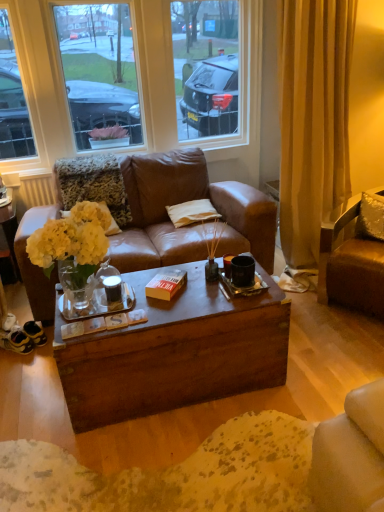
Question: From a real-world perspective, is brown leather chair at right on top of satin silver pillow at upper right, which ranks as the first pillow in right-to-left order?

Choices:
 (A) yes
 (B) no

Answer: (B)

Question: Does brown leather chair at right have a greater width compared to satin silver pillow at upper right, the first pillow in the front-to-back sequence?

Choices:
 (A) no
 (B) yes

Answer: (B)

Question: Does brown leather chair at right have a lesser height compared to satin silver pillow at upper right, the 2th pillow when ordered from left to right?

Choices:
 (A) yes
 (B) no

Answer: (B)

Question: Does brown leather chair at right have a greater height compared to satin silver pillow at upper right, which ranks as the first pillow in right-to-left order?

Choices:
 (A) no
 (B) yes

Answer: (B)

Question: Does brown leather chair at right have a smaller size compared to satin silver pillow at upper right, which ranks as the first pillow in right-to-left order?

Choices:
 (A) no
 (B) yes

Answer: (A)

Question: Looking at their shapes, would you say brown leather chair at right is wider or thinner than orange matte book at center?

Choices:
 (A) wide
 (B) thin

Answer: (A)

Question: Is brown leather chair at right taller or shorter than orange matte book at center?

Choices:
 (A) tall
 (B) short

Answer: (A)

Question: Considering the positions of point (352, 298) and point (183, 283), is point (352, 298) closer or farther from the camera than point (183, 283)?

Choices:
 (A) closer
 (B) farther

Answer: (B)

Question: Considering the relative positions of brown leather chair at right and orange matte book at center in the image provided, is brown leather chair at right to the left or to the right of orange matte book at center?

Choices:
 (A) left
 (B) right

Answer: (B)

Question: Considering the relative positions of yellow matte flowers at center and orange matte book at center in the image provided, is yellow matte flowers at center to the left or to the right of orange matte book at center?

Choices:
 (A) left
 (B) right

Answer: (A)

Question: Looking at their shapes, would you say yellow matte flowers at center is wider or thinner than orange matte book at center?

Choices:
 (A) thin
 (B) wide

Answer: (B)

Question: Is yellow matte flowers at center in front of or behind orange matte book at center in the image?

Choices:
 (A) front
 (B) behind

Answer: (B)

Question: From the image's perspective, is yellow matte flowers at center above or below orange matte book at center?

Choices:
 (A) below
 (B) above

Answer: (B)

Question: From the image's perspective, is beige fabric pillow at center, the 1th pillow viewed from the back, above or below brown leather chair at right?

Choices:
 (A) above
 (B) below

Answer: (A)

Question: From a real-world perspective, relative to brown leather chair at right, is beige fabric pillow at center, positioned as the second pillow in right-to-left order, vertically above or below?

Choices:
 (A) below
 (B) above

Answer: (B)